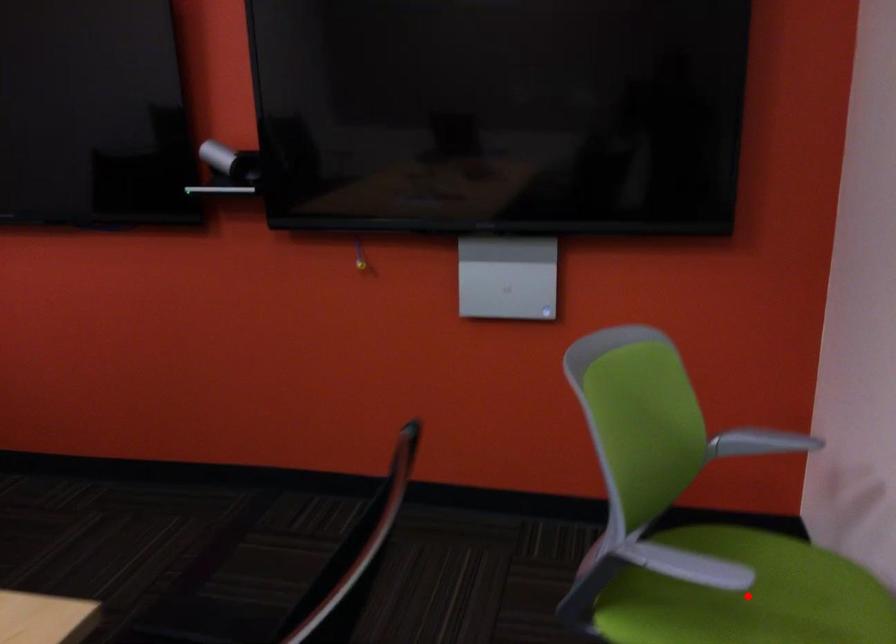
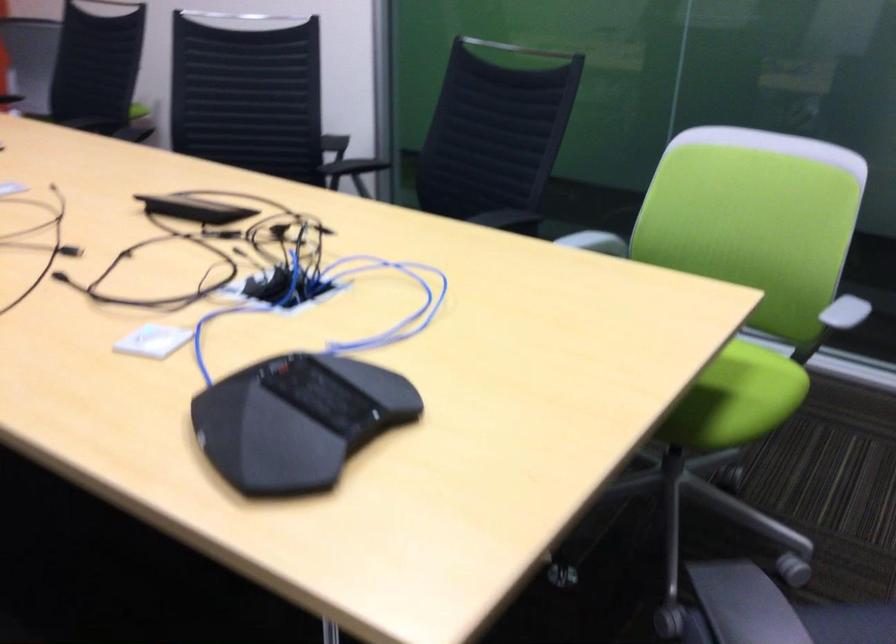
Question: I am providing you with two images of the same scene from different viewpoints. A red point is marked on the first image. Is the red point's position out of view in image 2?

Choices:
 (A) Yes
 (B) No

Answer: (A)